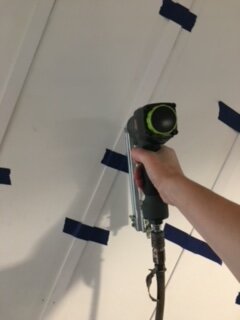
The height and width of the screenshot is (320, 240). I want to click on device to secure aspects of wall, so click(x=144, y=118).